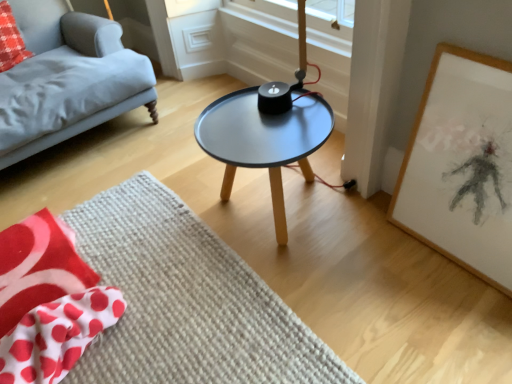
Question: From the image's perspective, is matte gray fabric couch at left under red polka dot fabric at upper left?

Choices:
 (A) no
 (B) yes

Answer: (B)

Question: Is matte gray fabric couch at left smaller than red polka dot fabric at upper left?

Choices:
 (A) yes
 (B) no

Answer: (B)

Question: From a real-world perspective, is matte gray fabric couch at left below red polka dot fabric at upper left?

Choices:
 (A) yes
 (B) no

Answer: (A)

Question: From the image's perspective, is matte gray fabric couch at left on top of red polka dot fabric at upper left?

Choices:
 (A) no
 (B) yes

Answer: (A)

Question: Is matte gray fabric couch at left at the right side of red polka dot fabric at upper left?

Choices:
 (A) no
 (B) yes

Answer: (B)

Question: Is matte gray fabric couch at left shorter than red polka dot fabric at upper left?

Choices:
 (A) no
 (B) yes

Answer: (A)

Question: Does white paper with charcoal drawing at right have a greater height compared to matte black table at center?

Choices:
 (A) yes
 (B) no

Answer: (A)

Question: Is the depth of white paper with charcoal drawing at right greater than that of matte black table at center?

Choices:
 (A) yes
 (B) no

Answer: (B)

Question: From the image's perspective, does white paper with charcoal drawing at right appear lower than matte black table at center?

Choices:
 (A) yes
 (B) no

Answer: (A)

Question: From a real-world perspective, is white paper with charcoal drawing at right under matte black table at center?

Choices:
 (A) no
 (B) yes

Answer: (A)

Question: From the image's perspective, is white paper with charcoal drawing at right above matte black table at center?

Choices:
 (A) no
 (B) yes

Answer: (A)

Question: From a real-world perspective, is white paper with charcoal drawing at right positioned over matte black table at center based on gravity?

Choices:
 (A) no
 (B) yes

Answer: (B)

Question: Is white paper with charcoal drawing at right a part of matte gray fabric couch at left?

Choices:
 (A) no
 (B) yes

Answer: (A)